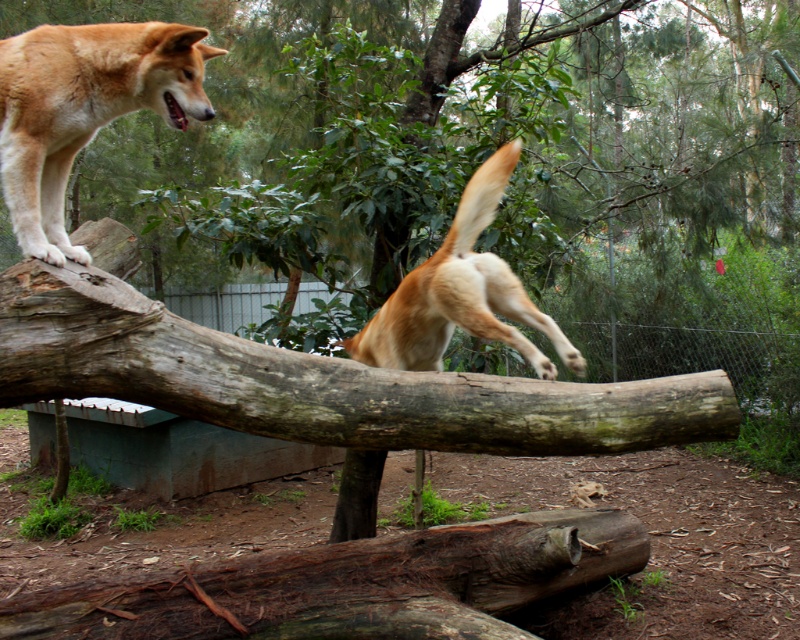
Which is below, rusty wooden log at lower center or golden fur dog at upper left?

rusty wooden log at lower center is below.

Is point (16, 611) positioned behind point (6, 136)?

Yes, it is behind point (6, 136).

You are a GUI agent. You are given a task and a screenshot of the screen. Output one action in this format:
    pyautogui.click(x=<x>, y=<y>)
    Task: Click on the rusty wooden log at lower center
    The image size is (800, 640).
    Given the screenshot: What is the action you would take?
    pyautogui.click(x=352, y=584)

How much distance is there between golden fur dog at upper left and golden fur dog at center?

A distance of 3.65 feet exists between golden fur dog at upper left and golden fur dog at center.

Who is lower down, golden fur dog at upper left or golden fur dog at center?

golden fur dog at center is lower down.

Locate an element on the screen. This screenshot has width=800, height=640. golden fur dog at upper left is located at coordinates coord(84,109).

The width and height of the screenshot is (800, 640). I want to click on rusty wooden log at lower center, so click(x=352, y=584).

Who is positioned more to the left, rusty wooden log at lower center or golden fur dog at center?

Positioned to the left is rusty wooden log at lower center.

You are a GUI agent. You are given a task and a screenshot of the screen. Output one action in this format:
    pyautogui.click(x=<x>, y=<y>)
    Task: Click on the rusty wooden log at lower center
    
    Given the screenshot: What is the action you would take?
    pyautogui.click(x=352, y=584)

Locate an element on the screen. The height and width of the screenshot is (640, 800). rusty wooden log at lower center is located at coordinates (352, 584).